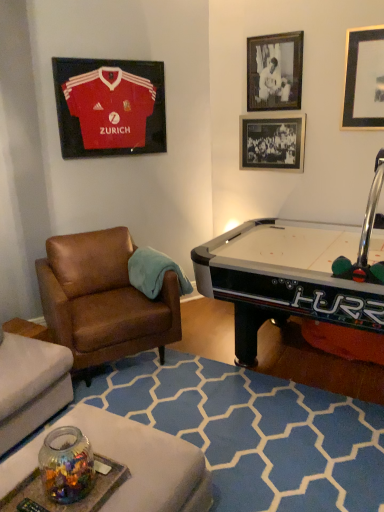
Question: Considering the relative sizes of black matte picture frame at upper right, the 2th picture frame viewed from the left, and brown leather chair at left in the image provided, is black matte picture frame at upper right, the 2th picture frame viewed from the left, thinner than brown leather chair at left?

Choices:
 (A) no
 (B) yes

Answer: (B)

Question: Does black matte picture frame at upper right, arranged as the 3th picture frame when viewed from the right, appear on the left side of brown leather chair at left?

Choices:
 (A) no
 (B) yes

Answer: (A)

Question: Is black matte picture frame at upper right, the 2th picture frame viewed from the left, not within brown leather chair at left?

Choices:
 (A) yes
 (B) no

Answer: (A)

Question: Does black matte picture frame at upper right, arranged as the 3th picture frame when viewed from the right, have a smaller size compared to brown leather chair at left?

Choices:
 (A) no
 (B) yes

Answer: (B)

Question: Is black matte picture frame at upper right, the 2th picture frame viewed from the left, surrounding brown leather chair at left?

Choices:
 (A) no
 (B) yes

Answer: (A)

Question: Considering the positions of black matte picture frame at upper right, marked as the 4th picture frame in a left-to-right arrangement, and black matte picture frame at upper right, the 2th picture frame viewed from the left, in the image, is black matte picture frame at upper right, marked as the 4th picture frame in a left-to-right arrangement, bigger or smaller than black matte picture frame at upper right, the 2th picture frame viewed from the left,?

Choices:
 (A) big
 (B) small

Answer: (B)

Question: From a real-world perspective, relative to black matte picture frame at upper right, the 2th picture frame viewed from the left, is black matte picture frame at upper right, which appears as the first picture frame when viewed from the right, vertically above or below?

Choices:
 (A) below
 (B) above

Answer: (A)

Question: Is point (372, 79) closer or farther from the camera than point (299, 47)?

Choices:
 (A) closer
 (B) farther

Answer: (A)

Question: From the image's perspective, is black matte picture frame at upper right, which appears as the first picture frame when viewed from the right, above or below black matte picture frame at upper right, arranged as the 3th picture frame when viewed from the right?

Choices:
 (A) below
 (B) above

Answer: (A)

Question: Considering the positions of point (77, 248) and point (289, 94), is point (77, 248) closer or farther from the camera than point (289, 94)?

Choices:
 (A) farther
 (B) closer

Answer: (B)

Question: From the image's perspective, is brown leather chair at left positioned above or below black matte picture frame at upper right, arranged as the 3th picture frame when viewed from the right?

Choices:
 (A) above
 (B) below

Answer: (B)

Question: From their relative heights in the image, would you say brown leather chair at left is taller or shorter than black matte picture frame at upper right, the 2th picture frame viewed from the left?

Choices:
 (A) short
 (B) tall

Answer: (B)

Question: In the image, is brown leather chair at left positioned in front of or behind black matte picture frame at upper right, arranged as the 3th picture frame when viewed from the right?

Choices:
 (A) behind
 (B) front

Answer: (B)

Question: Is black glass picture frame at upper right, the 2th picture frame from the right, situated inside black matte picture frame at upper right, marked as the 4th picture frame in a left-to-right arrangement, or outside?

Choices:
 (A) outside
 (B) inside

Answer: (A)

Question: Is black glass picture frame at upper right, placed as the 3th picture frame when sorted from left to right, bigger or smaller than black matte picture frame at upper right, which appears as the first picture frame when viewed from the right?

Choices:
 (A) small
 (B) big

Answer: (B)